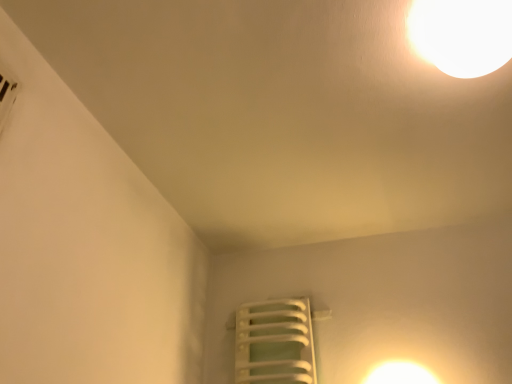
Question: Is white glossy lampshade at upper right turned away from white glossy light at upper right?

Choices:
 (A) no
 (B) yes

Answer: (A)

Question: Is white glossy lampshade at upper right not near white glossy light at upper right?

Choices:
 (A) no
 (B) yes

Answer: (B)

Question: Considering the relative sizes of white glossy lampshade at upper right and white glossy light at upper right in the image provided, is white glossy lampshade at upper right taller than white glossy light at upper right?

Choices:
 (A) yes
 (B) no

Answer: (B)

Question: Could you tell me if white glossy lampshade at upper right is facing white glossy light at upper right?

Choices:
 (A) yes
 (B) no

Answer: (B)

Question: Is white glossy lampshade at upper right outside of white glossy light at upper right?

Choices:
 (A) no
 (B) yes

Answer: (B)

Question: Visually, is white plastic radiator at lower center positioned to the left or to the right of white glossy light at upper right?

Choices:
 (A) left
 (B) right

Answer: (A)

Question: Does point (x=245, y=347) appear closer or farther from the camera than point (x=381, y=377)?

Choices:
 (A) closer
 (B) farther

Answer: (B)

Question: Looking at the image, does white plastic radiator at lower center seem bigger or smaller compared to white glossy light at upper right?

Choices:
 (A) small
 (B) big

Answer: (B)

Question: From a real-world perspective, relative to white glossy light at upper right, is white plastic radiator at lower center vertically above or below?

Choices:
 (A) below
 (B) above

Answer: (B)

Question: From a real-world perspective, is white glossy light at upper right above or below white glossy lampshade at upper right?

Choices:
 (A) below
 (B) above

Answer: (A)

Question: From their relative heights in the image, would you say white glossy light at upper right is taller or shorter than white glossy lampshade at upper right?

Choices:
 (A) tall
 (B) short

Answer: (A)

Question: Is white glossy light at upper right wider or thinner than white glossy lampshade at upper right?

Choices:
 (A) thin
 (B) wide

Answer: (A)

Question: Looking at the image, does white glossy light at upper right seem bigger or smaller compared to white glossy lampshade at upper right?

Choices:
 (A) small
 (B) big

Answer: (A)

Question: Which is correct: white glossy lampshade at upper right is inside white glossy light at upper right, or outside of it?

Choices:
 (A) outside
 (B) inside

Answer: (A)

Question: From a real-world perspective, is white glossy lampshade at upper right physically located above or below white glossy light at upper right?

Choices:
 (A) above
 (B) below

Answer: (A)